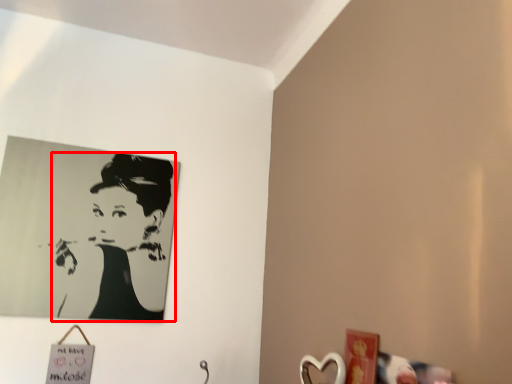
Question: From the image's perspective, where is woman (annotated by the red box) located in relation to picture frame in the image?

Choices:
 (A) above
 (B) below

Answer: (A)